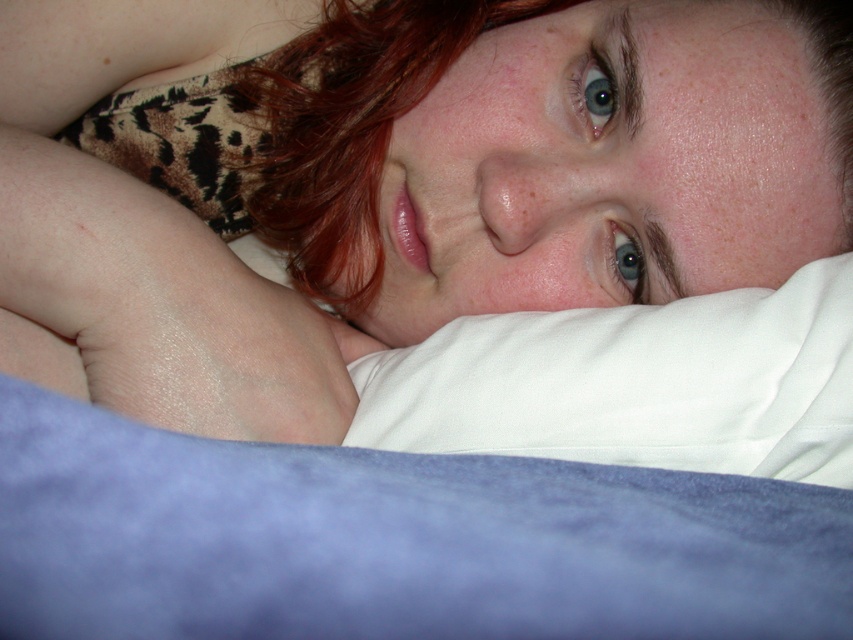
Does matte white pillow at upper center have a greater height compared to blue velvety sheet at lower center?

Correct, matte white pillow at upper center is much taller as blue velvety sheet at lower center.

How far apart are matte white pillow at upper center and blue velvety sheet at lower center?

9.63 inches

Between point (480, 113) and point (572, 490), which one is positioned behind?

The point (480, 113) is behind.

You are a GUI agent. You are given a task and a screenshot of the screen. Output one action in this format:
    pyautogui.click(x=<x>, y=<y>)
    Task: Click on the matte white pillow at upper center
    Image resolution: width=853 pixels, height=640 pixels.
    Given the screenshot: What is the action you would take?
    pyautogui.click(x=404, y=184)

Who is more distant from viewer, (421, 262) or (466, 436)?

The point (421, 262) is behind.

Who is shorter, matte white pillow at upper center or white soft pillow at center?

white soft pillow at center is shorter.

Is point (587, 72) farther from viewer compared to point (744, 417)?

Yes, it is.

Where is `matte white pillow at upper center`? The image size is (853, 640). matte white pillow at upper center is located at coordinates (404, 184).

Measure the distance between blue velvety sheet at lower center and camera.

They are 14.54 centimeters apart.

Between point (51, 454) and point (752, 336), which one is positioned in front?

Point (51, 454) is more forward.

Is point (523, 493) in front of point (743, 376)?

Yes.

At what (x,y) coordinates should I click in order to perform the action: click on blue velvety sheet at lower center. Please return your answer as a coordinate pair (x, y). The image size is (853, 640). Looking at the image, I should click on (392, 540).